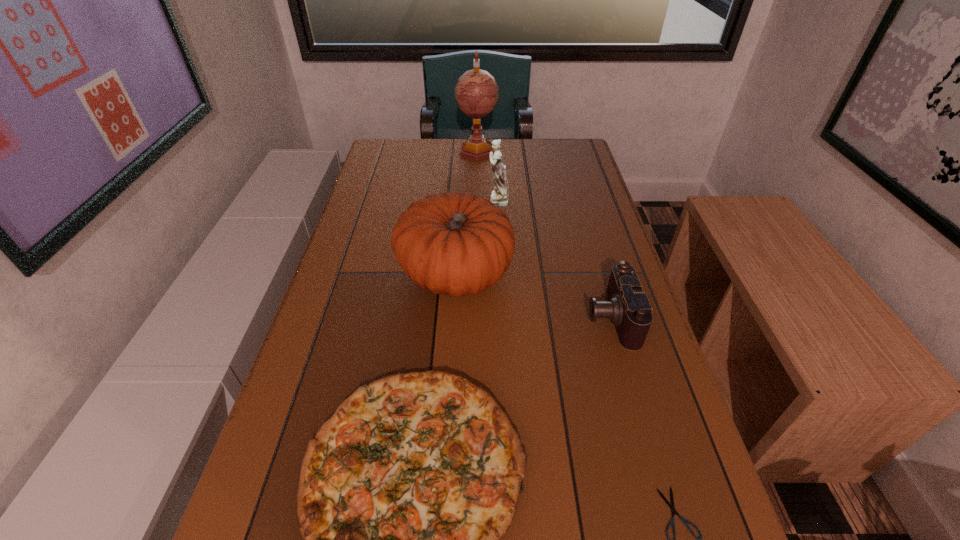
Locate which object ranks in proximity to the shortest object. Please provide its 2D coordinates. Your answer should be formatted as a tuple, i.e. [(x, y)], where the tuple contains the x and y coordinates of a point satisfying the conditions above.

[(404, 493)]